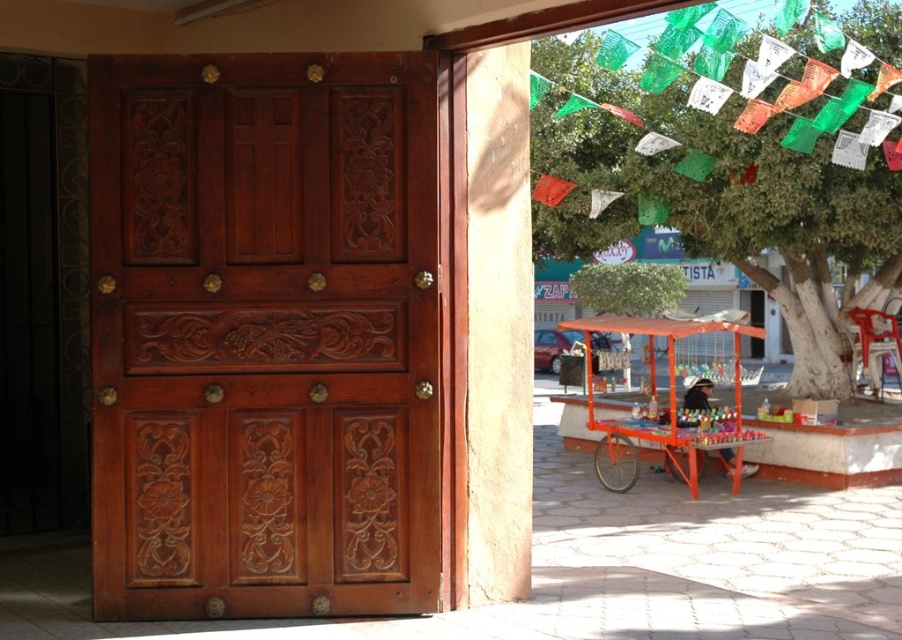
You are standing in front of the wooden door and want to locate the green leafy tree at upper right. Based on the coordinates provided, can you describe its exact position relative to the door?

The green leafy tree at upper right is located at coordinates point (738, 166), which places it in the upper right area of the image, above and to the right of the wooden door.

You are standing in front of the scene and want to enter the courtyard. The entrance is through the polished wood door at left. To reach the entrance, you need to walk towards the door. Based on the coordinates given, is the door positioned to your left or right side when facing the scene?

The polished wood door at left is located at point (263, 336), which means it is positioned to your left side when facing the scene. Therefore, you should walk towards your left to reach the entrance.

You are a painter setting up an easel to sketch this scene. You want to focus on the green leafy tree at upper right and the orange metallic cart at center. Which object should you place closer to the center of your canvas if you want to emphasize its size?

You should place the orange metallic cart at center closer to the center of your canvas because it is thicker than the green leafy tree at upper right, making it more prominent in size.